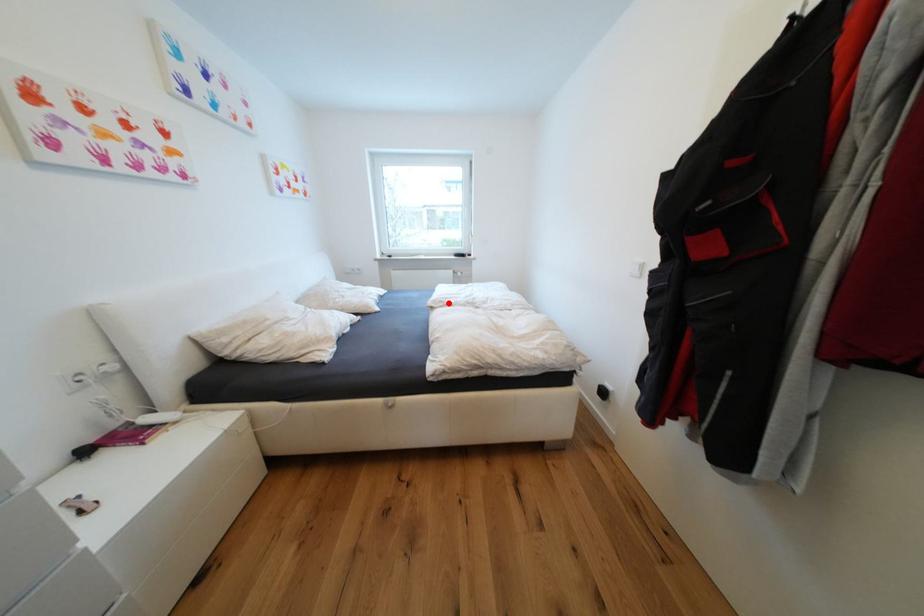
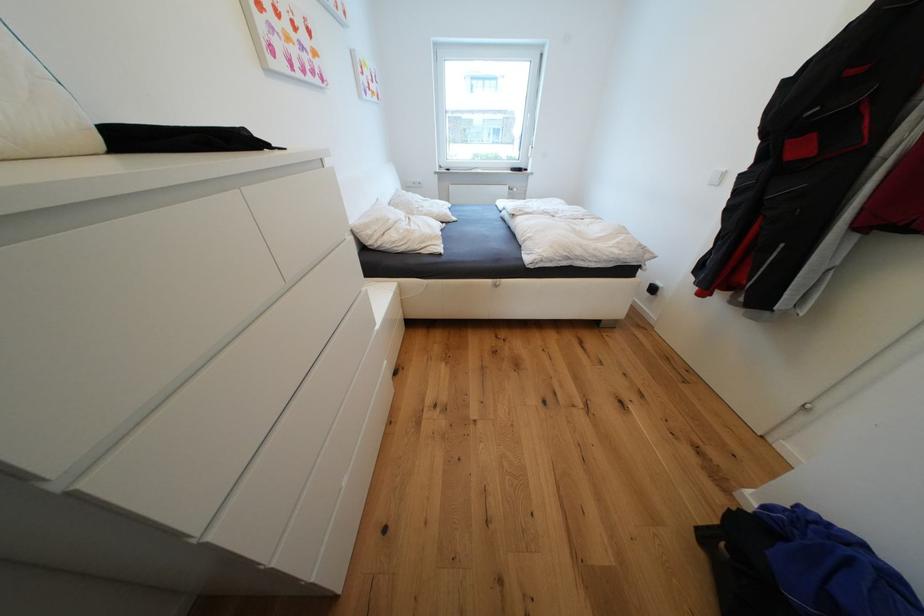
Question: I am providing you with two images of the same scene from different viewpoints. Given a red point in image1, look at the same physical point in image2. Is it:

Choices:
 (A) Closer to the viewpoint
 (B) Farther from the viewpoint

Answer: (A)